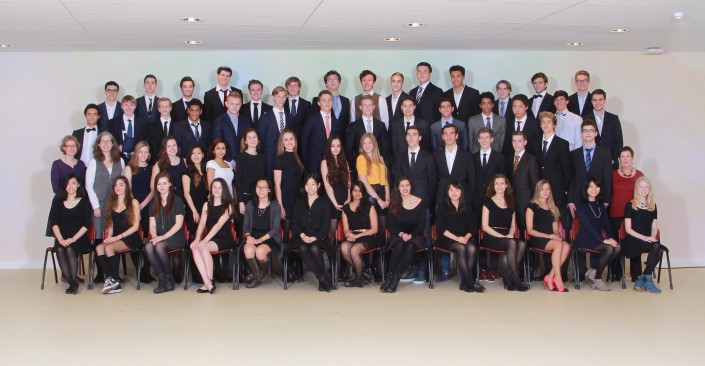
In order to click on artificial lights in this screenshot , I will do `click(617, 31)`, `click(575, 45)`, `click(392, 40)`, `click(416, 26)`, `click(192, 42)`, `click(190, 20)`, `click(3, 47)`.